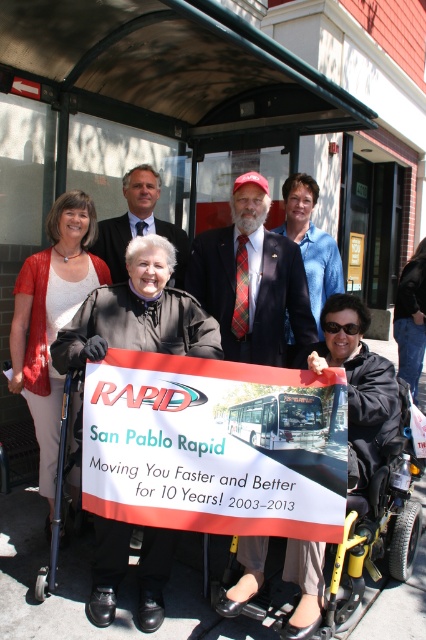
Is plaid fabric tie at center taller than metallic silver wheelchair at lower left?

No, plaid fabric tie at center is not taller than metallic silver wheelchair at lower left.

The image size is (426, 640). Describe the element at coordinates (252, 280) in the screenshot. I see `plaid fabric tie at center` at that location.

Describe the element at coordinates (252, 280) in the screenshot. The height and width of the screenshot is (640, 426). I see `plaid fabric tie at center` at that location.

You are a GUI agent. You are given a task and a screenshot of the screen. Output one action in this format:
    pyautogui.click(x=<x>, y=<y>)
    Task: Click on the plaid fabric tie at center
    
    Given the screenshot: What is the action you would take?
    pyautogui.click(x=252, y=280)

Does white paper sign at center have a lesser height compared to dark blue suit at center?

Indeed, white paper sign at center has a lesser height compared to dark blue suit at center.

How much distance is there between white paper sign at center and dark blue suit at center?

The distance of white paper sign at center from dark blue suit at center is 5.68 feet.

Describe the element at coordinates (215, 445) in the screenshot. I see `white paper sign at center` at that location.

The image size is (426, 640). Find the location of `white paper sign at center`. white paper sign at center is located at coordinates (215, 445).

Is point (138, 419) positioned before point (255, 264)?

That is True.

Measure the distance between point (270, 412) and camera.

A distance of 2.47 meters exists between point (270, 412) and camera.

This screenshot has width=426, height=640. I want to click on white paper sign at center, so click(215, 445).